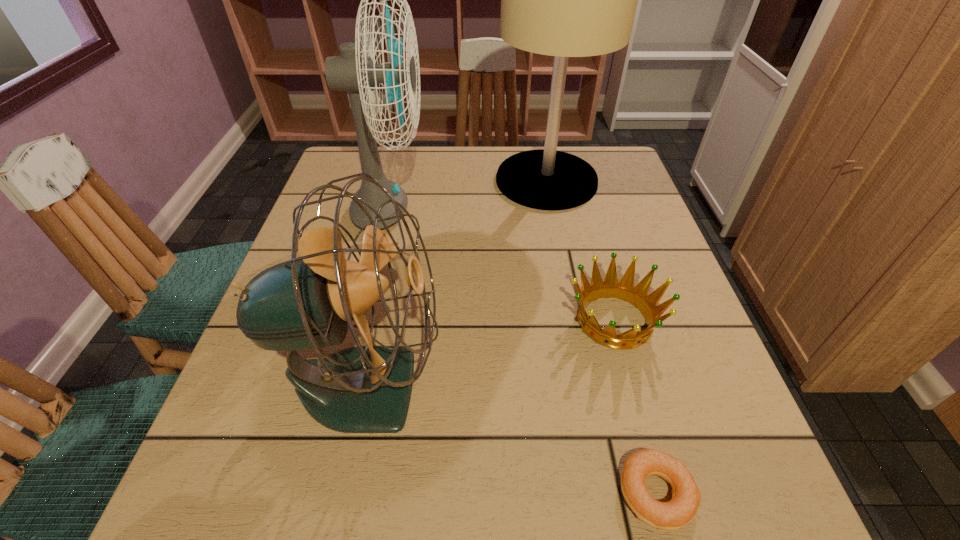
Where is `object at the far right corner`? The image size is (960, 540). object at the far right corner is located at coordinates (565, 0).

The height and width of the screenshot is (540, 960). I want to click on object located in the near right corner section of the desktop, so click(682, 508).

The height and width of the screenshot is (540, 960). I want to click on vacant space at the far edge of the desktop, so click(x=416, y=158).

Locate an element on the screen. The width and height of the screenshot is (960, 540). free space at the near edge is located at coordinates (481, 492).

In the image, there is a desktop. Where is `vacant region at the left edge`? The width and height of the screenshot is (960, 540). vacant region at the left edge is located at coordinates (324, 223).

Find the location of a particular element. vacant area at the right edge is located at coordinates (648, 241).

In the image, there is a desktop. What are the coordinates of `free region at the far left corner` in the screenshot? It's located at (350, 157).

Where is `blank space at the near left corner of the desktop`? blank space at the near left corner of the desktop is located at coordinates [198, 494].

I want to click on vacant point at the far right corner, so click(x=606, y=149).

At what (x,y) coordinates should I click in order to perform the action: click on empty space between the table lamp and the nearer fan. Please return your answer as a coordinate pair (x, y). The image size is (960, 540). Looking at the image, I should click on (455, 283).